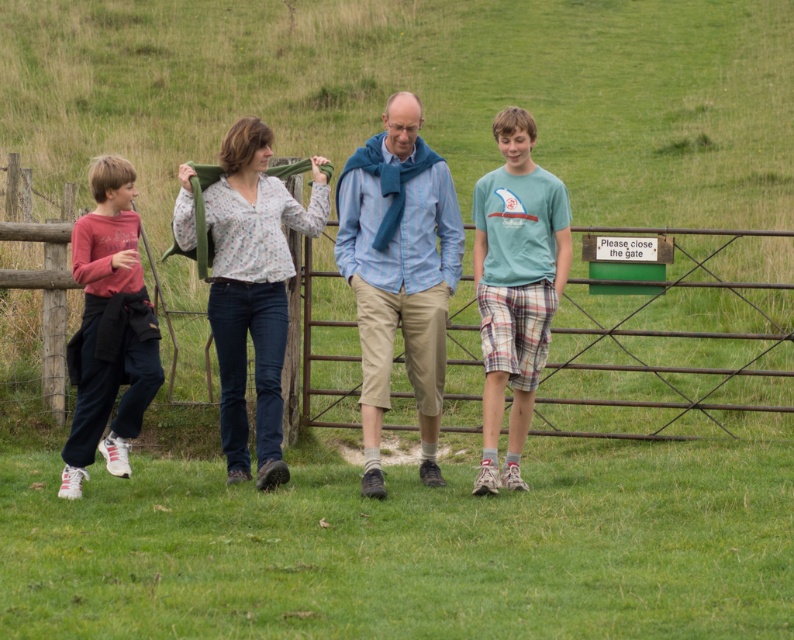
Question: Is matte blue shirt at center bigger than floral print shirt at center?

Choices:
 (A) yes
 (B) no

Answer: (B)

Question: Which of the following is the farthest from the observer?

Choices:
 (A) teal t-shirt at center
 (B) matte blue shirt at center

Answer: (A)

Question: From the image, what is the correct spatial relationship of green wooden gate at center in relation to teal t-shirt at center?

Choices:
 (A) left
 (B) right

Answer: (A)

Question: Which point is closer to the camera taking this photo?

Choices:
 (A) (421, 116)
 (B) (530, 396)
 (C) (130, 291)

Answer: (C)

Question: Is green wooden gate at center above light blue striped shirt at center?

Choices:
 (A) no
 (B) yes

Answer: (B)

Question: Estimate the real-world distances between objects in this image. Which object is farther from the matte blue shirt at center?

Choices:
 (A) teal t-shirt at center
 (B) green wooden gate at center
 (C) matte red shirt at left
 (D) floral print shirt at center

Answer: (B)